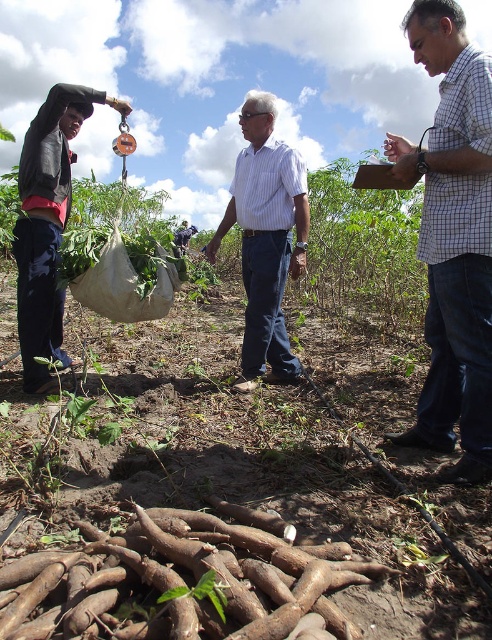
Is white striped shirt at center smaller than dark blue jeans at left?

Yes, white striped shirt at center is smaller than dark blue jeans at left.

Does point (301, 209) lie behind point (60, 120)?

No, it is in front of (60, 120).

Where is `white striped shirt at center`? Image resolution: width=492 pixels, height=640 pixels. white striped shirt at center is located at coordinates (266, 237).

Which is behind, point (461, 280) or point (279, 326)?

The point (279, 326) is behind.

Which is below, white checkered shirt at center or white striped shirt at center?

white checkered shirt at center is lower down.

Who is more distant from viewer, (485, 260) or (300, 177)?

Positioned behind is point (300, 177).

The image size is (492, 640). Identify the location of white checkered shirt at center. (453, 241).

Which is more to the left, brown rough root at lower center or light blue striped shirt at center?

light blue striped shirt at center

Does brown rough root at lower center have a lesser width compared to light blue striped shirt at center?

Yes.

Which is in front, point (93, 548) or point (183, 234)?

Point (93, 548) is more forward.

Find the location of `brown rough root at lower center`. brown rough root at lower center is located at coordinates (182, 580).